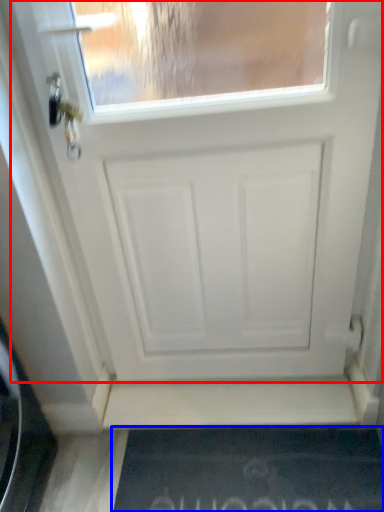
Question: Which point is closer to the camera, door (highlighted by a red box) or doormat (highlighted by a blue box)?

Choices:
 (A) door
 (B) doormat

Answer: (A)